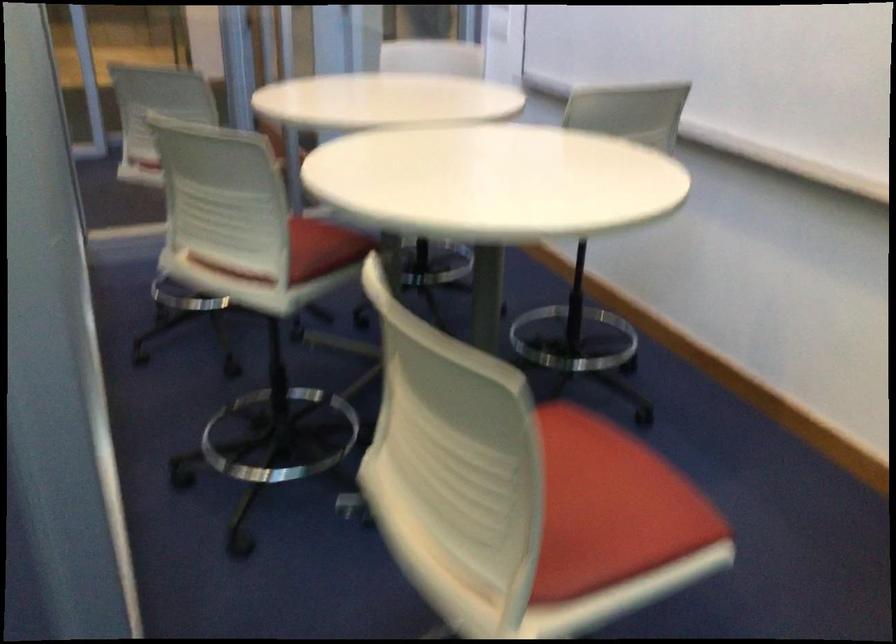
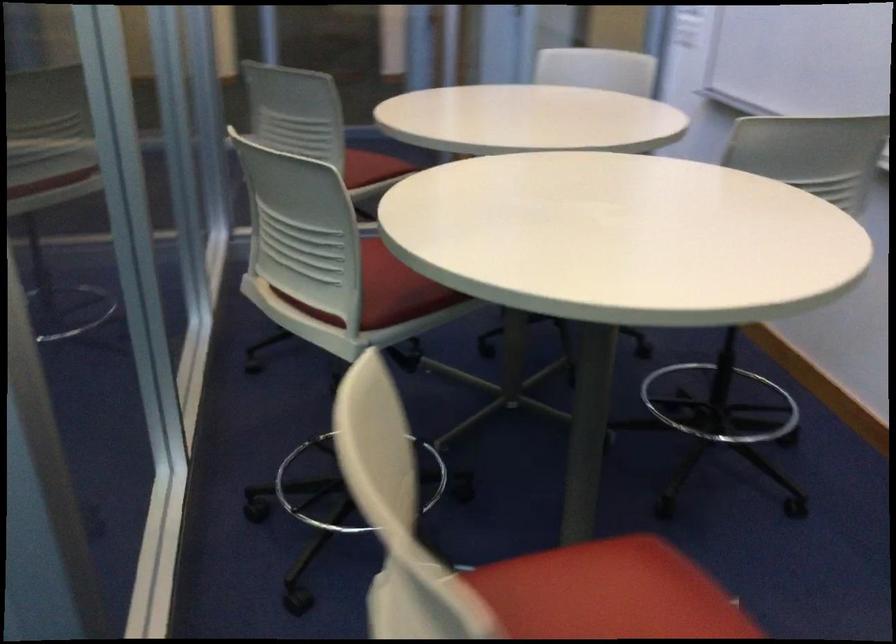
Where in the second image is the point corresponding to (308,251) from the first image?

(397, 289)